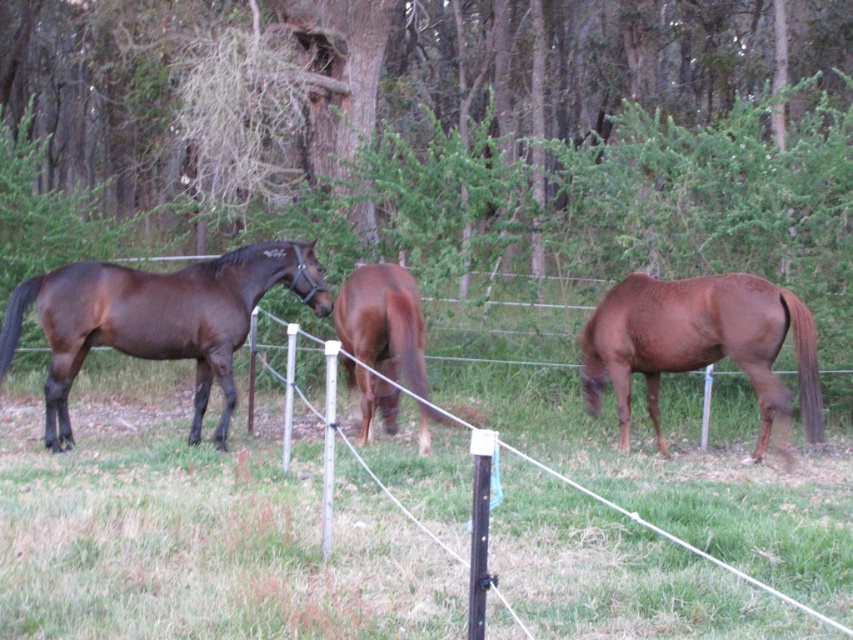
Can you confirm if shiny dark brown horse at left is positioned to the right of brown glossy horse at center?

Incorrect, shiny dark brown horse at left is not on the right side of brown glossy horse at center.

Consider the image. Does shiny dark brown horse at left lie behind brown glossy horse at center?

That is True.

What do you see at coordinates (157, 320) in the screenshot? I see `shiny dark brown horse at left` at bounding box center [157, 320].

You are a GUI agent. You are given a task and a screenshot of the screen. Output one action in this format:
    pyautogui.click(x=<x>, y=<y>)
    Task: Click on the shiny dark brown horse at left
    Image resolution: width=853 pixels, height=640 pixels.
    Given the screenshot: What is the action you would take?
    pyautogui.click(x=157, y=320)

Is point (625, 355) positioned before point (375, 310)?

No, (625, 355) is behind (375, 310).

What are the coordinates of `brown glossy horse at right` in the screenshot? It's located at (701, 346).

Find the location of a particular element. The height and width of the screenshot is (640, 853). brown glossy horse at right is located at coordinates tap(701, 346).

Is shiny dark brown horse at left behind brown glossy horse at right?

Yes, it is.

Where is `shiny dark brown horse at left`? shiny dark brown horse at left is located at coordinates (157, 320).

At what (x,y) coordinates should I click in order to perform the action: click on shiny dark brown horse at left. Please return your answer as a coordinate pair (x, y). Looking at the image, I should click on pos(157,320).